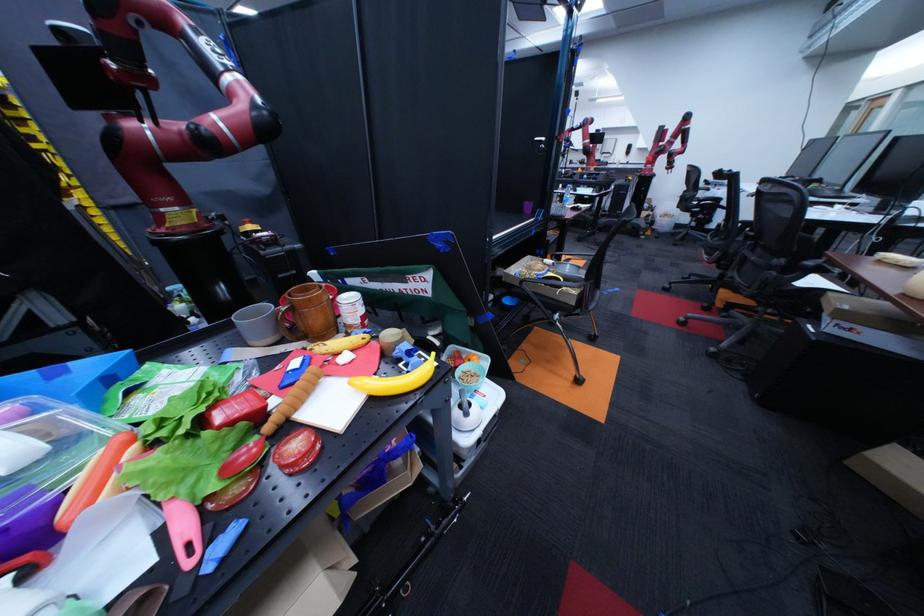
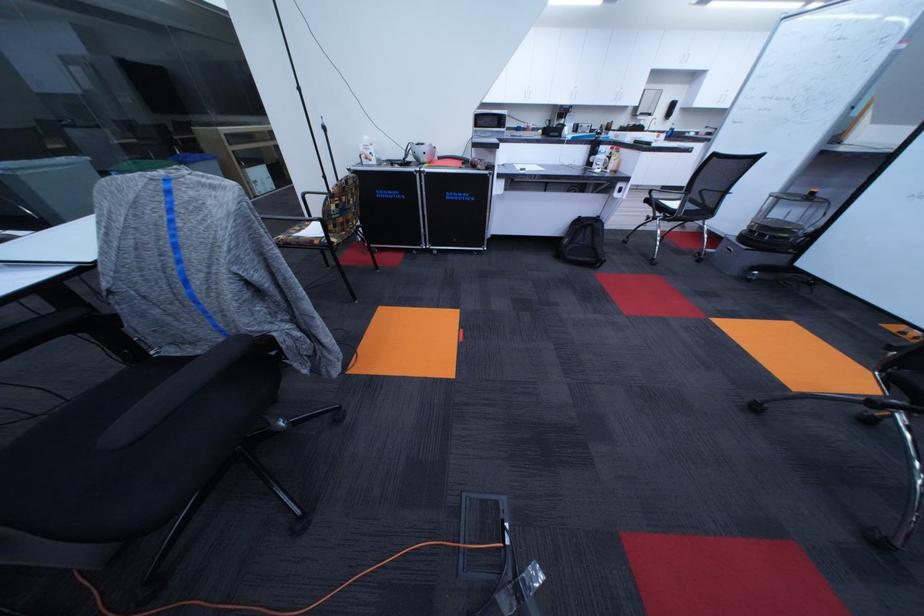
Locate, in the second image, the point that corresponds to pixel 642 148 in the first image.

(686, 107)